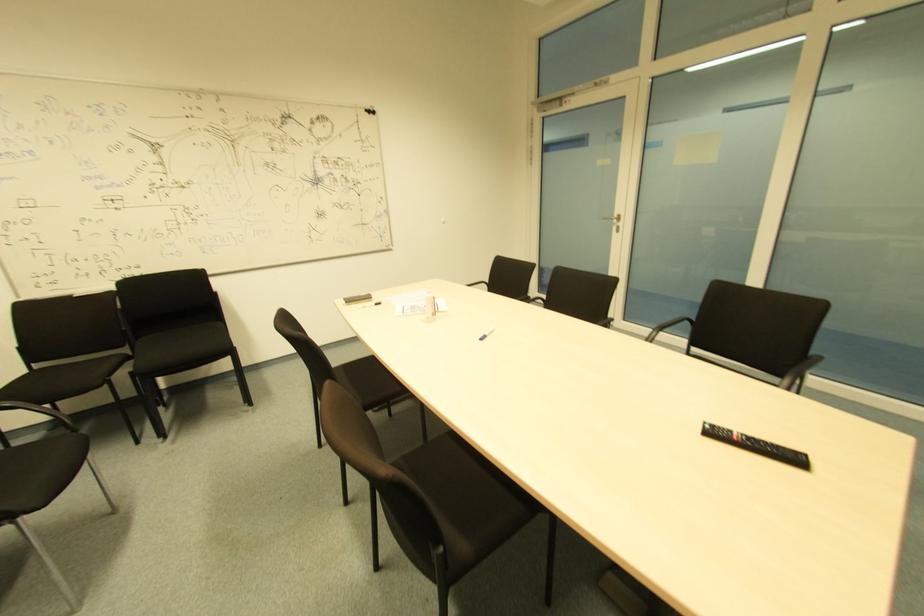
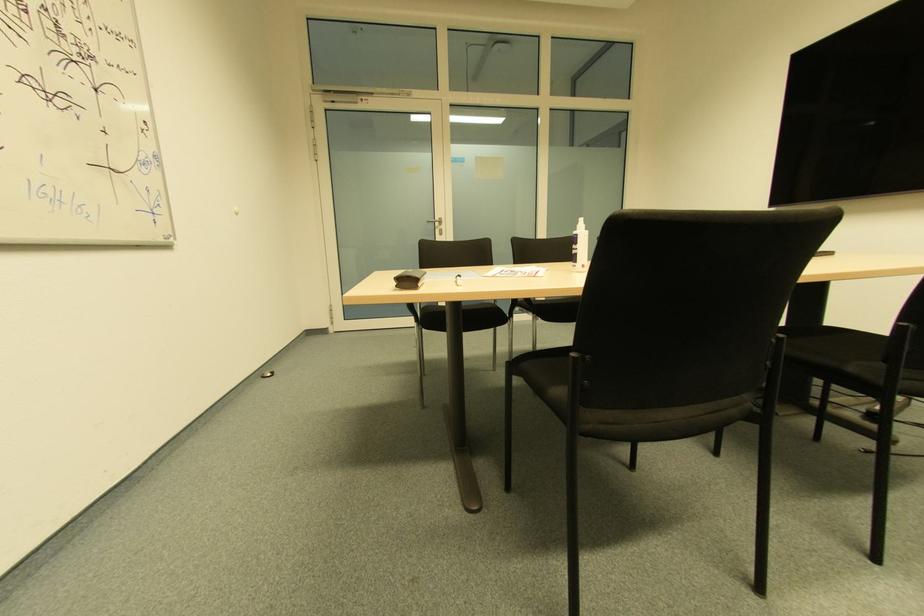
Find the pixel in the second image that matches the point at 618,227 in the first image.

(440, 230)